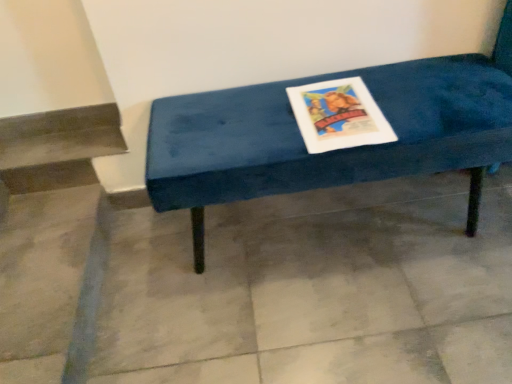
Question: From their relative heights in the image, would you say gray tile floor at center is taller or shorter than velvet blue bench at center?

Choices:
 (A) tall
 (B) short

Answer: (B)

Question: In the image, is gray tile floor at center positioned in front of or behind velvet blue bench at center?

Choices:
 (A) front
 (B) behind

Answer: (B)

Question: Would you say gray tile floor at center is inside or outside velvet blue bench at center?

Choices:
 (A) inside
 (B) outside

Answer: (B)

Question: Considering their positions, is velvet blue bench at center located in front of or behind gray tile floor at center?

Choices:
 (A) behind
 (B) front

Answer: (B)

Question: Is velvet blue bench at center bigger or smaller than gray tile floor at center?

Choices:
 (A) big
 (B) small

Answer: (A)

Question: From a real-world perspective, is velvet blue bench at center above or below gray tile floor at center?

Choices:
 (A) above
 (B) below

Answer: (A)

Question: Does point (245, 185) appear closer or farther from the camera than point (400, 253)?

Choices:
 (A) farther
 (B) closer

Answer: (B)